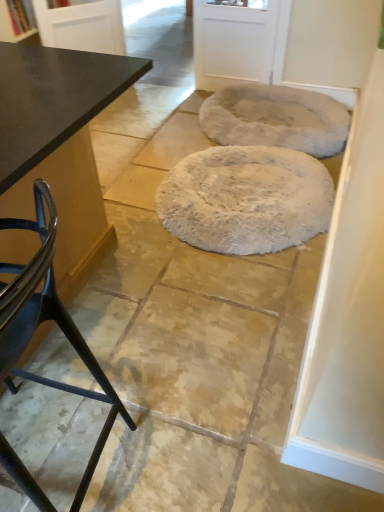
Question: Is glossy black table at upper left, the 2th screen door from the right, further to the viewer compared to fuzzy gray mat at upper right, arranged as the 2th mat when viewed from the front?

Choices:
 (A) yes
 (B) no

Answer: (A)

Question: Considering the relative sizes of glossy black table at upper left, the 2th screen door from the right, and fuzzy gray mat at upper right, acting as the 1th mat starting from the back, in the image provided, is glossy black table at upper left, the 2th screen door from the right, taller than fuzzy gray mat at upper right, acting as the 1th mat starting from the back,?

Choices:
 (A) yes
 (B) no

Answer: (A)

Question: Is glossy black table at upper left, arranged as the first screen door when viewed from the left, oriented away from fuzzy gray mat at upper right, acting as the 1th mat starting from the back?

Choices:
 (A) no
 (B) yes

Answer: (A)

Question: Is glossy black table at upper left, the 2th screen door from the right, not within fuzzy gray mat at upper right, acting as the 1th mat starting from the back?

Choices:
 (A) no
 (B) yes

Answer: (B)

Question: Would you say glossy black table at upper left, the 2th screen door from the right, contains fuzzy gray mat at upper right, acting as the 1th mat starting from the back?

Choices:
 (A) no
 (B) yes

Answer: (A)

Question: From the image's perspective, is fuzzy gray mat at upper right, acting as the 1th mat starting from the back, above or below glossy black table at upper left, the 2th screen door from the right?

Choices:
 (A) below
 (B) above

Answer: (A)

Question: From their relative heights in the image, would you say fuzzy gray mat at upper right, arranged as the 2th mat when viewed from the front, is taller or shorter than glossy black table at upper left, the 2th screen door from the right?

Choices:
 (A) short
 (B) tall

Answer: (A)

Question: Is point (326, 98) positioned closer to the camera than point (44, 7)?

Choices:
 (A) farther
 (B) closer

Answer: (A)

Question: In the image, is fuzzy gray mat at upper right, arranged as the 2th mat when viewed from the front, on the left side or the right side of glossy black table at upper left, arranged as the first screen door when viewed from the left?

Choices:
 (A) left
 (B) right

Answer: (B)

Question: Looking at the image, does white fluffy rug at center, the 1th mat when ordered from front to back, seem bigger or smaller compared to fuzzy gray mat at upper right, acting as the 1th mat starting from the back?

Choices:
 (A) big
 (B) small

Answer: (B)

Question: From the image's perspective, is white fluffy rug at center, acting as the second mat starting from the back, above or below fuzzy gray mat at upper right, acting as the 1th mat starting from the back?

Choices:
 (A) below
 (B) above

Answer: (A)

Question: Relative to fuzzy gray mat at upper right, acting as the 1th mat starting from the back, is white fluffy rug at center, the 1th mat when ordered from front to back, in front or behind?

Choices:
 (A) behind
 (B) front

Answer: (B)

Question: Is point (x=221, y=249) closer or farther from the camera than point (x=261, y=142)?

Choices:
 (A) farther
 (B) closer

Answer: (B)

Question: From their relative heights in the image, would you say matte black chair at left is taller or shorter than glossy black table at upper left, arranged as the first screen door when viewed from the left?

Choices:
 (A) tall
 (B) short

Answer: (A)

Question: From a real-world perspective, is matte black chair at left above or below glossy black table at upper left, arranged as the first screen door when viewed from the left?

Choices:
 (A) below
 (B) above

Answer: (B)